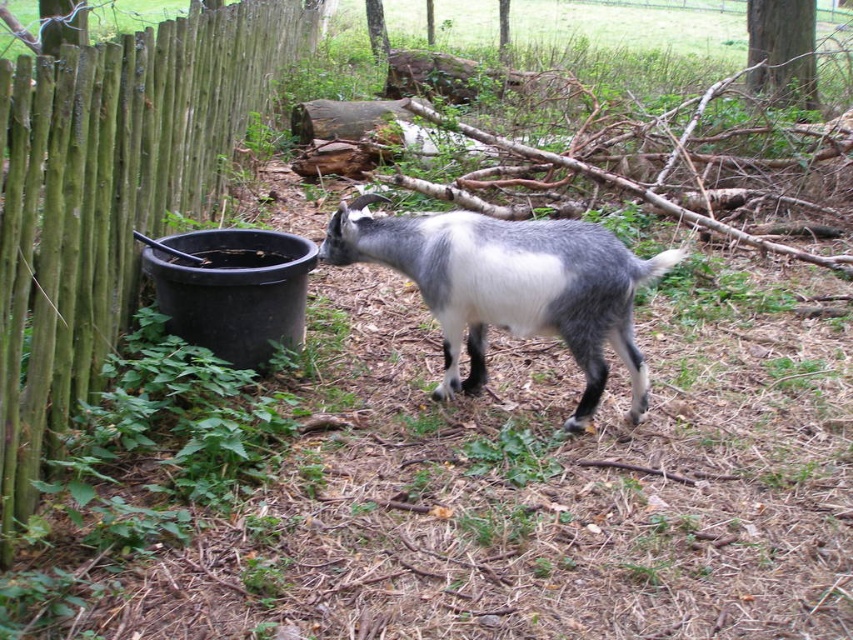
Question: Which object appears farthest from the camera in this image?

Choices:
 (A) green wood fence at left
 (B) gray woolen goat at center

Answer: (A)

Question: Which of the following is the closest to the observer?

Choices:
 (A) green wood fence at left
 (B) gray woolen goat at center

Answer: (B)

Question: Is green wood fence at left positioned before gray woolen goat at center?

Choices:
 (A) no
 (B) yes

Answer: (A)

Question: Is green wood fence at left to the right of gray woolen goat at center from the viewer's perspective?

Choices:
 (A) no
 (B) yes

Answer: (A)

Question: In this image, where is green wood fence at left located relative to gray woolen goat at center?

Choices:
 (A) left
 (B) right

Answer: (A)